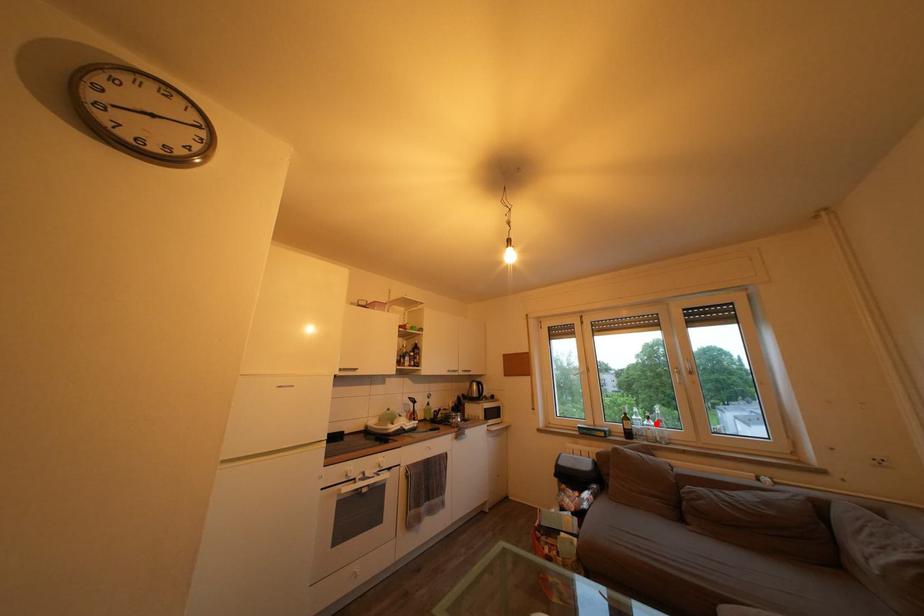
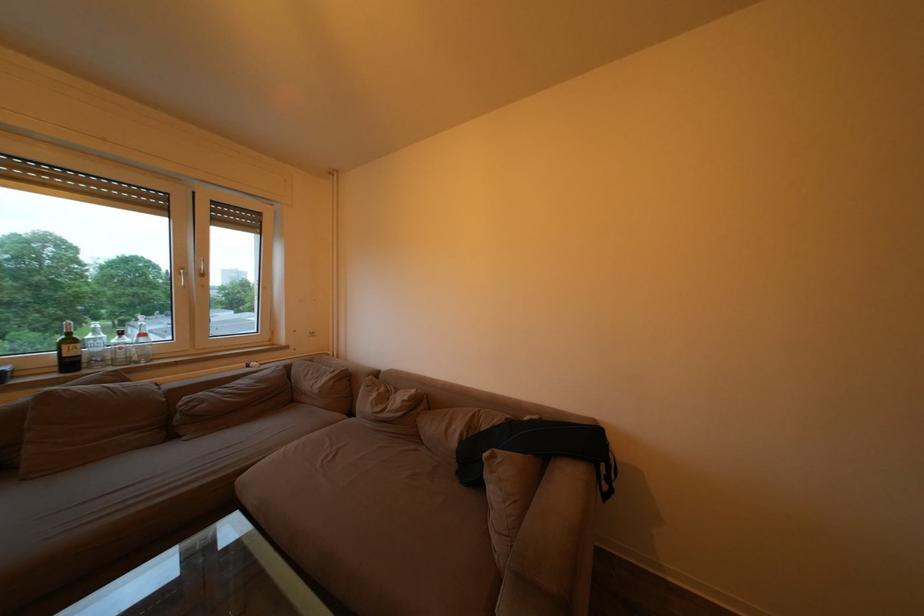
Question: I am providing you with two images of the same scene from different viewpoints. Given a red point in image1, look at the same physical point in image2. Is it:

Choices:
 (A) Closer to the viewpoint
 (B) Farther from the viewpoint

Answer: (A)